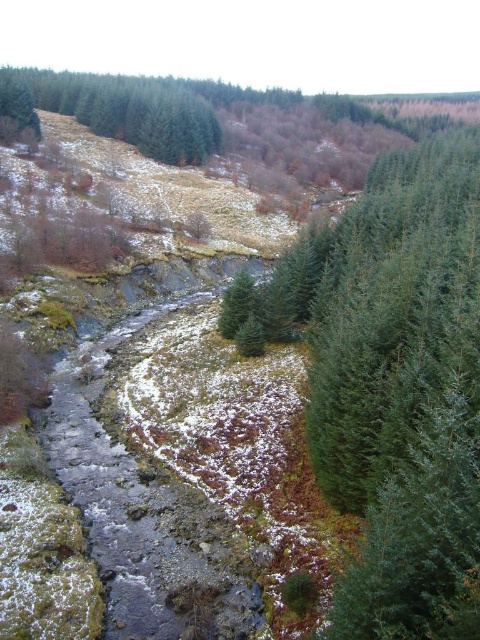
You are standing at the point marked by point (395,384) and want to cross the stream to the left bank. Is there enough space between the green needle like tree at center right and the stream to move sideways?

The green needle like tree at center right is represented by point (395,384), so you are standing right at the base of the tree. There is no space to move sideways between the tree and the stream as you are already at the tree location.